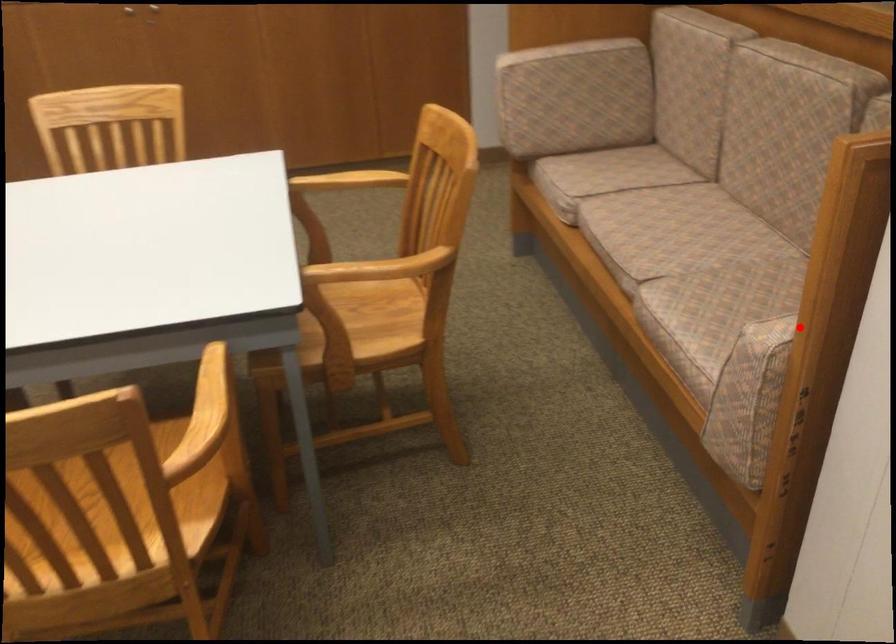
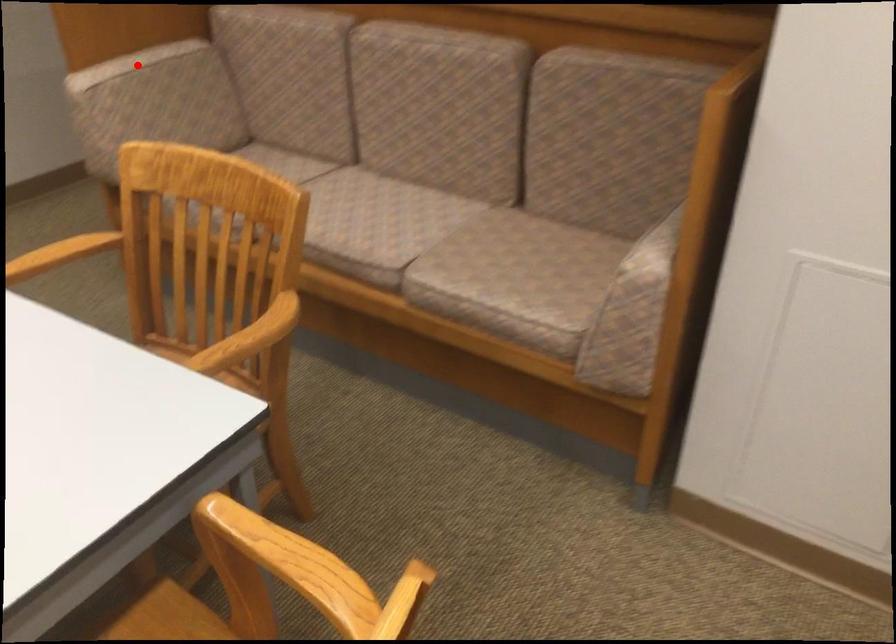
I am providing you with two images of the same scene from different viewpoints. A red point is marked on the first image and another point is marked on the second image. Do the highlighted points in image1 and image2 indicate the same real-world spot?

No